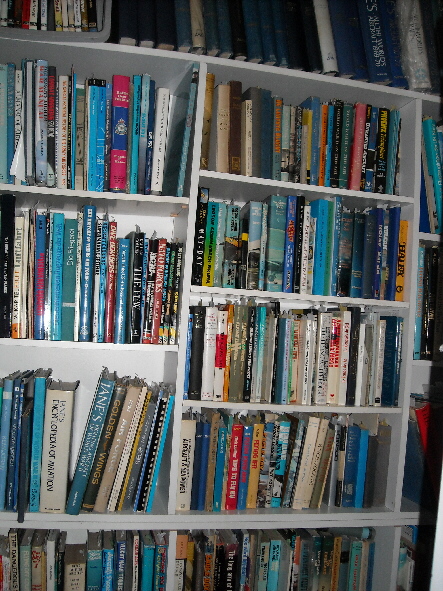
The width and height of the screenshot is (443, 591). I want to click on back of book shelf, so click(161, 230), click(137, 350).